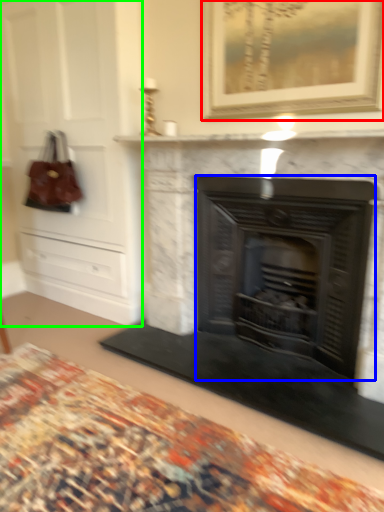
Question: Estimate the real-world distances between objects in this image. Which object is closer to picture frame (highlighted by a red box), fireplace (highlighted by a blue box) or dresser (highlighted by a green box)?

Choices:
 (A) fireplace
 (B) dresser

Answer: (A)